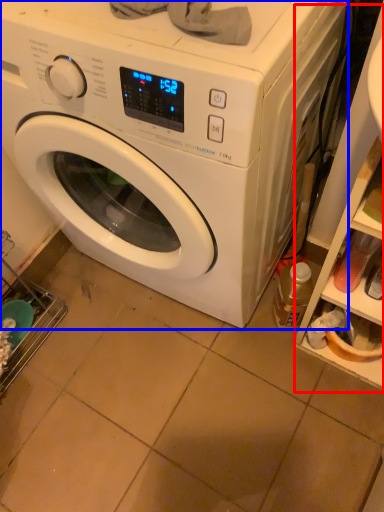
Question: Which object is closer to the camera taking this photo, shelf (highlighted by a red box) or washing machine (highlighted by a blue box)?

Choices:
 (A) shelf
 (B) washing machine

Answer: (B)